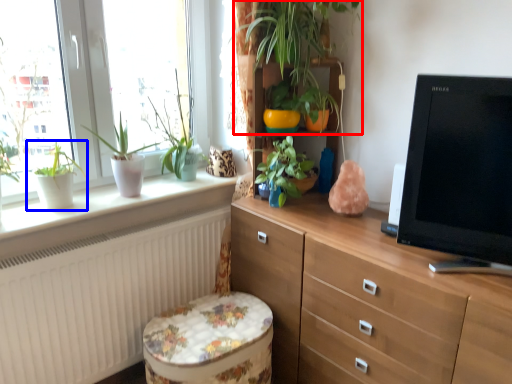
Question: Which of the following is the closest to the observer, houseplant (highlighted by a red box) or houseplant (highlighted by a blue box)?

Choices:
 (A) houseplant
 (B) houseplant

Answer: (A)